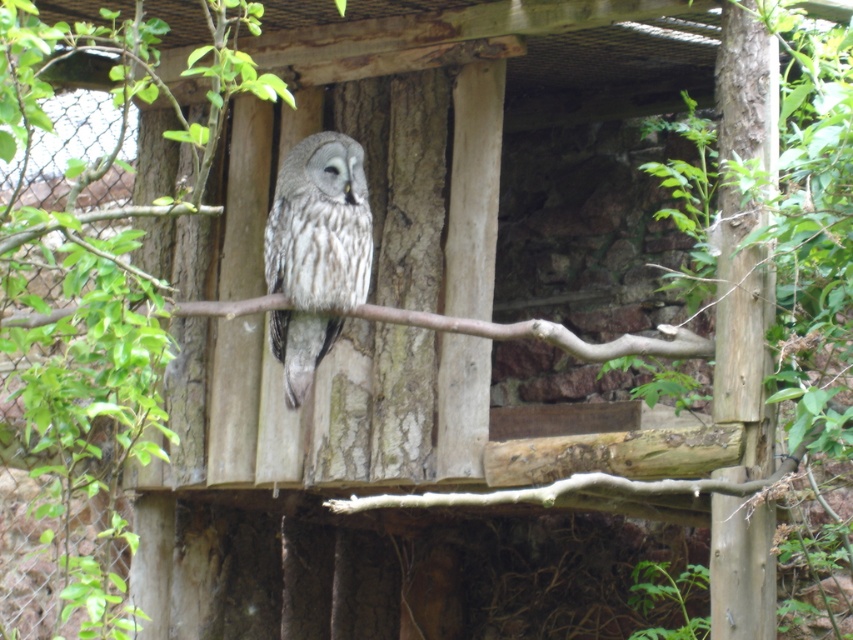
You are a zookeeper observing the owl enclosure. You notice the smooth brown wood at right and the speckled feathered owl at center. Which object is positioned to the right of the other?

The smooth brown wood at right is to the right of the speckled feathered owl at center according to the description.

You are standing in front of the owl enclosure and notice two points marked on the wooden platform. The first point is at coordinate point (753, 556) and the second is at point (294, 273). Which of these two points is nearer to you?

Point (753, 556) is closer to the viewer than point (294, 273).

You are an owl enthusiast observing the enclosure. You notice the smooth brown wood at right and the speckled feathered owl at center. Which object is positioned lower in the enclosure?

The smooth brown wood at right is positioned lower than the speckled feathered owl at center because it is located below it.